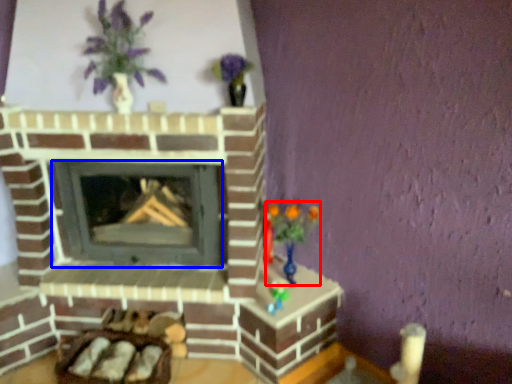
Question: Which object is further to the camera taking this photo, toy (highlighted by a red box) or wood burning stove (highlighted by a blue box)?

Choices:
 (A) toy
 (B) wood burning stove

Answer: (B)